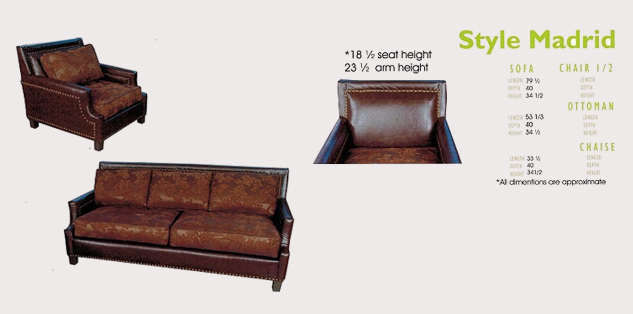
You are a GUI agent. You are given a task and a screenshot of the screen. Output one action in this format:
    pyautogui.click(x=<x>, y=<y>)
    Task: Click on the right front couch leg
    
    Given the screenshot: What is the action you would take?
    pyautogui.click(x=70, y=261)